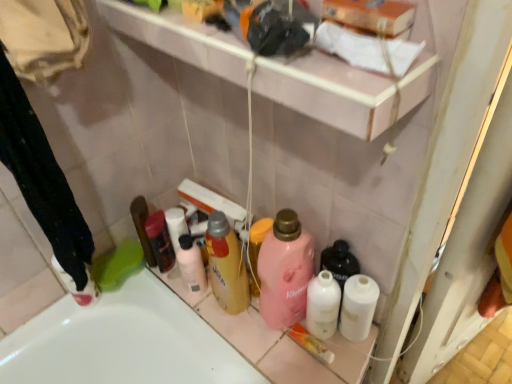
The width and height of the screenshot is (512, 384). In order to click on pink matte lotion at center, the 2th toiletry positioned from the left in this screenshot , I will do `click(191, 265)`.

This screenshot has height=384, width=512. What do you see at coordinates (358, 307) in the screenshot?
I see `white matte bottle at lower right, marked as the first toiletry in a right-to-left arrangement` at bounding box center [358, 307].

Describe the element at coordinates (323, 305) in the screenshot. This screenshot has width=512, height=384. I see `white plastic bottle at center, acting as the third toiletry starting from the left` at that location.

Describe the element at coordinates (285, 271) in the screenshot. I see `pink matte bottle at center, the first cleaning product positioned from the right` at that location.

Describe the element at coordinates (352, 47) in the screenshot. I see `white paper towel at upper center` at that location.

The width and height of the screenshot is (512, 384). I want to click on pink glossy shelf at upper center, so click(x=329, y=92).

At what (x,y) coordinates should I click in order to perform the action: click on matte black hair spray at left, placed as the 1th toiletry when sorted from left to right. Please return your answer as a coordinate pair (x, y). Looking at the image, I should click on (160, 241).

The image size is (512, 384). I want to click on pink matte lotion at center, positioned as the fourth toiletry in right-to-left order, so click(x=191, y=265).

From the image's perspective, which is below, matte black hair spray at left, placed as the 1th toiletry when sorted from left to right, or black fabric laundry at lower left?

matte black hair spray at left, placed as the 1th toiletry when sorted from left to right, appears lower in the image.

Between point (157, 217) and point (83, 284), which one is positioned in front?

The point (83, 284) is closer to the camera.

Can you tell me how much matte black hair spray at left, placed as the 1th toiletry when sorted from left to right, and black fabric laundry at lower left differ in facing direction?

The facing directions of matte black hair spray at left, placed as the 1th toiletry when sorted from left to right, and black fabric laundry at lower left are 87.6 degrees apart.

Considering the relative positions of matte black hair spray at left, placed as the 1th toiletry when sorted from left to right, and black fabric laundry at lower left in the image provided, is matte black hair spray at left, placed as the 1th toiletry when sorted from left to right, behind black fabric laundry at lower left?

Yes, it is behind black fabric laundry at lower left.

In terms of height, does black fabric laundry at lower left look taller or shorter compared to pink glossy shelf at upper center?

Clearly, black fabric laundry at lower left is taller compared to pink glossy shelf at upper center.

Is black fabric laundry at lower left not near pink glossy shelf at upper center?

black fabric laundry at lower left is actually quite close to pink glossy shelf at upper center.

Find the location of `laundry below the pink glossy shelf at upper center (from a real-world perspective)`. laundry below the pink glossy shelf at upper center (from a real-world perspective) is located at coordinates (44, 184).

From the image's perspective, is black fabric laundry at lower left above or below pink glossy shelf at upper center?

Based on their image positions, black fabric laundry at lower left is located beneath pink glossy shelf at upper center.

From the image's perspective, which is above, pink glossy shelf at upper center or matte black hair spray at left, the fifth toiletry positioned from the right?

pink glossy shelf at upper center, from the image's perspective.

Is pink glossy shelf at upper center positioned far away from matte black hair spray at left, placed as the 1th toiletry when sorted from left to right?

They are positioned close to each other.

This screenshot has width=512, height=384. In order to click on shelf on the right of the matte black hair spray at left, placed as the 1th toiletry when sorted from left to right in this screenshot , I will do `click(329, 92)`.

Considering the sizes of objects pink glossy shelf at upper center and matte black hair spray at left, the fifth toiletry positioned from the right, in the image provided, who is shorter, pink glossy shelf at upper center or matte black hair spray at left, the fifth toiletry positioned from the right,?

Standing shorter between the two is pink glossy shelf at upper center.

How many degrees apart are the facing directions of black fabric laundry at lower left and pink matte lotion at center, the 2th toiletry positioned from the left?

The angular difference between black fabric laundry at lower left and pink matte lotion at center, the 2th toiletry positioned from the left, is 94.7 degrees.

From the image's perspective, is black fabric laundry at lower left above or below pink matte lotion at center, the 2th toiletry positioned from the left?

Clearly, from the image's perspective, black fabric laundry at lower left is above pink matte lotion at center, the 2th toiletry positioned from the left.

Is black fabric laundry at lower left taller than pink matte lotion at center, positioned as the fourth toiletry in right-to-left order?

Yes.

From a real-world perspective, relative to pink matte lotion at center, the 2th toiletry positioned from the left, is black fabric laundry at lower left vertically above or below?

black fabric laundry at lower left is situated higher than pink matte lotion at center, the 2th toiletry positioned from the left, in the real world.

From a real-world perspective, between white plastic bottle at center, the third toiletry from the right, and pink glossy shelf at upper center, who is vertically higher?

In real-world perspective, pink glossy shelf at upper center is above.

Does point (335, 309) come in front of point (206, 62)?

No, (335, 309) is behind (206, 62).

Where is `shelf that appears in front of the white plastic bottle at center, acting as the third toiletry starting from the left`? shelf that appears in front of the white plastic bottle at center, acting as the third toiletry starting from the left is located at coordinates (329, 92).

Who is bigger, white plastic bottle at center, acting as the third toiletry starting from the left, or pink glossy shelf at upper center?

pink glossy shelf at upper center.

Is white glossy lotion bottles at center, the fourth toiletry in the left-to-right sequence, directly adjacent to white matte bottle at lower right, the 5th toiletry positioned from the left?

Yes, white glossy lotion bottles at center, the fourth toiletry in the left-to-right sequence, and white matte bottle at lower right, the 5th toiletry positioned from the left, clearly make contact.

Is white glossy lotion bottles at center, which appears as the 2th toiletry when viewed from the right, to the left of white matte bottle at lower right, marked as the first toiletry in a right-to-left arrangement, from the viewer's perspective?

Yes, white glossy lotion bottles at center, which appears as the 2th toiletry when viewed from the right, is to the left of white matte bottle at lower right, marked as the first toiletry in a right-to-left arrangement.

From the image's perspective, is white glossy lotion bottles at center, the fourth toiletry in the left-to-right sequence, above white matte bottle at lower right, the 5th toiletry positioned from the left?

Yes, from the image's perspective, white glossy lotion bottles at center, the fourth toiletry in the left-to-right sequence, is above white matte bottle at lower right, the 5th toiletry positioned from the left.

Is white glossy lotion bottles at center, which appears as the 2th toiletry when viewed from the right, shorter than white matte bottle at lower right, marked as the first toiletry in a right-to-left arrangement?

No.

From a real-world perspective, between black fabric laundry at lower left and white glossy lotion bottles at center, which appears as the 2th toiletry when viewed from the right, who is vertically lower?

From a 3D spatial view, white glossy lotion bottles at center, which appears as the 2th toiletry when viewed from the right, is below.

Locate an element on the screen. laundry lying above the white glossy lotion bottles at center, which appears as the 2th toiletry when viewed from the right (from the image's perspective) is located at coordinates (44, 184).

From the image's perspective, which is below, black fabric laundry at lower left or white glossy lotion bottles at center, the fourth toiletry in the left-to-right sequence?

From the image's view, white glossy lotion bottles at center, the fourth toiletry in the left-to-right sequence, is below.

Is black fabric laundry at lower left to the left of white glossy lotion bottles at center, the fourth toiletry in the left-to-right sequence, from the viewer's perspective?

Yes.

Find the location of a particular element. The height and width of the screenshot is (384, 512). toiletry that is the 1st one when counting downward from the black fabric laundry at lower left (from the image's perspective) is located at coordinates (160, 241).

Where is `shelf in front of the black fabric laundry at lower left`? This screenshot has height=384, width=512. shelf in front of the black fabric laundry at lower left is located at coordinates tap(329, 92).

Looking at this image, based on their spatial positions, is pink glossy shelf at upper center or black fabric laundry at lower left closer to white glossy lotion bottles at center, the fourth toiletry in the left-to-right sequence?

pink glossy shelf at upper center is positioned closer to the anchor white glossy lotion bottles at center, the fourth toiletry in the left-to-right sequence.

Estimate the real-world distances between objects in this image. Which object is closer to pink glossy shelf at upper center, white plastic bottle at center, the third toiletry from the right, or black fabric laundry at lower left?

Among the two, black fabric laundry at lower left is located nearer to pink glossy shelf at upper center.

Consider the image. When comparing their distances from matte black hair spray at left, placed as the 1th toiletry when sorted from left to right, does white glossy lotion bottles at center, which appears as the 2th toiletry when viewed from the right, or white plastic bottle at center, acting as the third toiletry starting from the left, seem closer?

white plastic bottle at center, acting as the third toiletry starting from the left.

Considering their positions, is pink matte lotion at center, positioned as the fourth toiletry in right-to-left order, positioned further to pink matte bottle at center, the first cleaning product positioned from the right, than black fabric laundry at lower left?

The object further to pink matte bottle at center, the first cleaning product positioned from the right, is black fabric laundry at lower left.

When comparing their distances from white plastic bottle at center, the third toiletry from the right, does black fabric laundry at lower left or white paper towel at upper center seem closer?

white paper towel at upper center.

Considering their positions, is pink matte lotion at center, positioned as the fourth toiletry in right-to-left order, positioned further to pink matte bottle at center, the second cleaning product when ordered from left to right, than white paper towel at upper center?

white paper towel at upper center is further to pink matte bottle at center, the second cleaning product when ordered from left to right.

Estimate the real-world distances between objects in this image. Which object is closer to pink matte bottle at center, the first cleaning product positioned from the right, translucent yellow bottle at center, the 2th cleaning product positioned from the right, or pink matte lotion at center, the 2th toiletry positioned from the left?

Based on the image, translucent yellow bottle at center, the 2th cleaning product positioned from the right, appears to be nearer to pink matte bottle at center, the first cleaning product positioned from the right.

Based on their spatial positions, is black fabric laundry at lower left or pink matte lotion at center, the 2th toiletry positioned from the left, further from white glossy lotion bottles at center, which appears as the 2th toiletry when viewed from the right?

Among the two, black fabric laundry at lower left is located further to white glossy lotion bottles at center, which appears as the 2th toiletry when viewed from the right.

Where is `shelf situated between black fabric laundry at lower left and white paper towel at upper center from left to right`? shelf situated between black fabric laundry at lower left and white paper towel at upper center from left to right is located at coordinates (329, 92).

This screenshot has height=384, width=512. What are the coordinates of `shelf between black fabric laundry at lower left and white plastic bottle at center, acting as the third toiletry starting from the left` in the screenshot? It's located at click(329, 92).

This screenshot has width=512, height=384. What are the coordinates of `toiletry between matte black hair spray at left, the fifth toiletry positioned from the right, and pink matte bottle at center, the first cleaning product positioned from the right, from left to right` in the screenshot? It's located at (191, 265).

Where is `toilet paper between pink glossy shelf at upper center and translucent yellow bottle at center, the 2th cleaning product positioned from the right, vertically`? Image resolution: width=512 pixels, height=384 pixels. toilet paper between pink glossy shelf at upper center and translucent yellow bottle at center, the 2th cleaning product positioned from the right, vertically is located at coordinates (352, 47).